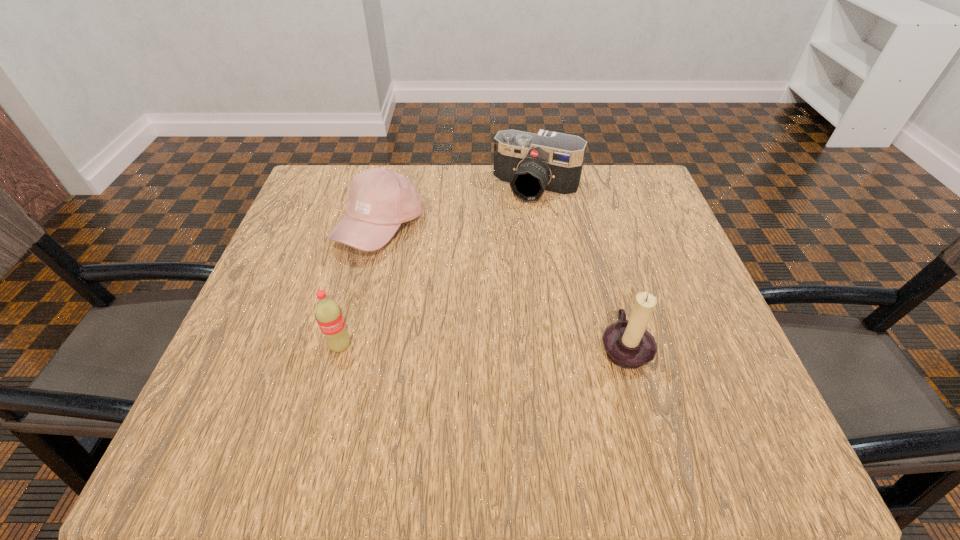
The width and height of the screenshot is (960, 540). In order to click on free spot on the desktop that is between the soda and the candle holder and is positioned on the front-facing side of the baseball cap in this screenshot , I will do `click(465, 346)`.

The width and height of the screenshot is (960, 540). I want to click on vacant space on the desktop that is between the soda and the candle holder and is positioned on the front-facing side of the camera, so click(x=455, y=346).